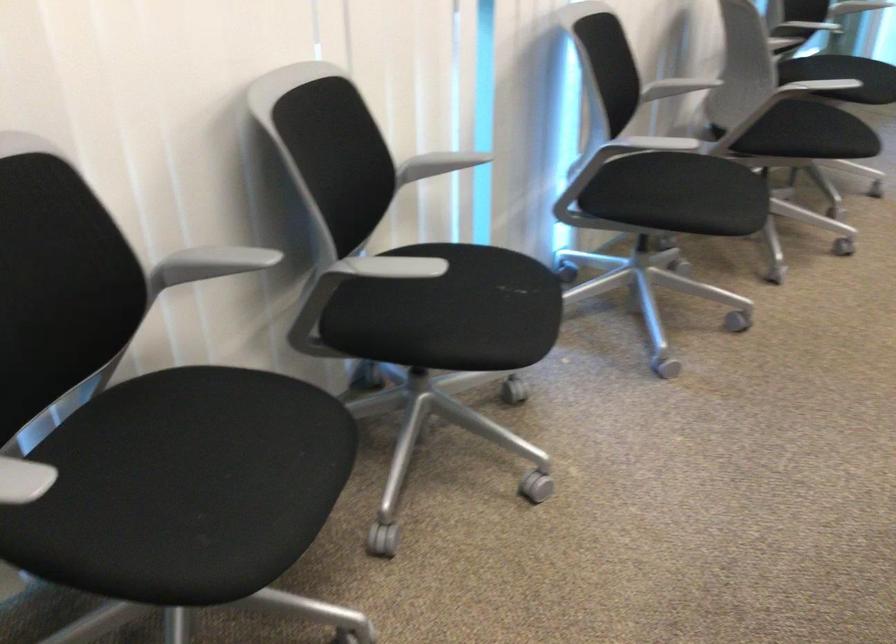
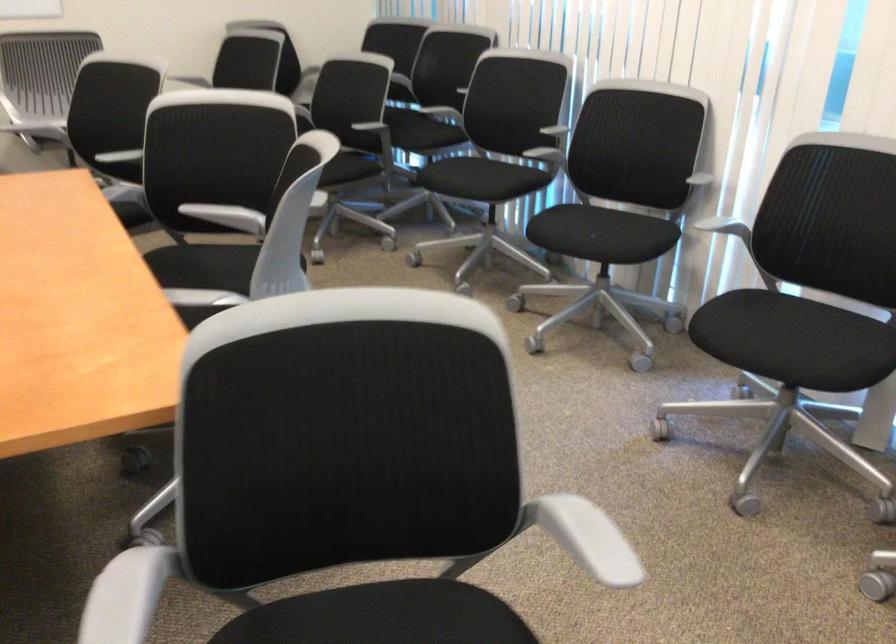
The point at (106, 342) is marked in the first image. Where is the corresponding point in the second image?

(543, 146)